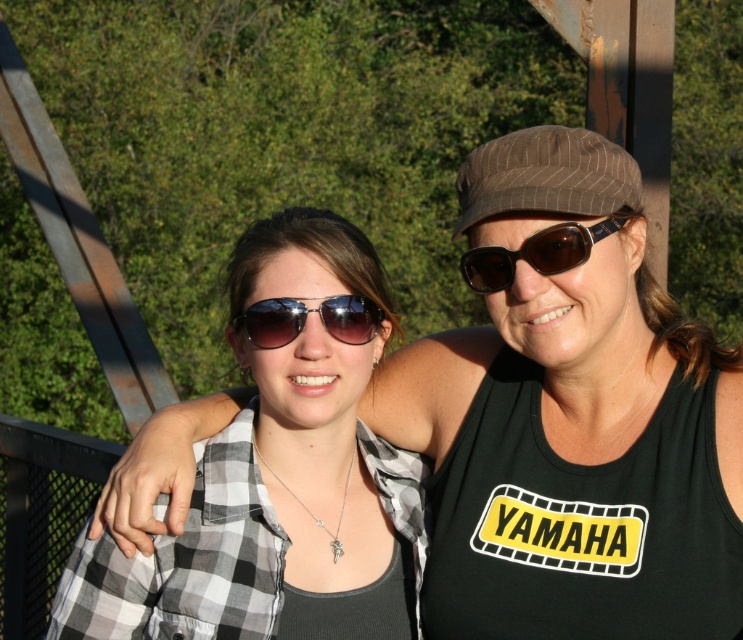
Can you confirm if black checkered shirt at center is positioned to the left of brown pinstripe baseball cap at upper right?

Correct, you'll find black checkered shirt at center to the left of brown pinstripe baseball cap at upper right.

Is point (444, 362) behind point (551, 193)?

Yes, it is behind point (551, 193).

This screenshot has height=640, width=743. Identify the location of black checkered shirt at center. (574, 458).

At what (x,y) coordinates should I click in order to perform the action: click on black checkered shirt at center. Please return your answer as a coordinate pair (x, y). The height and width of the screenshot is (640, 743). Looking at the image, I should click on (574, 458).

Between point (489, 429) and point (299, 321), which one is positioned in front?

Point (299, 321)

Which is behind, point (668, 563) or point (262, 340)?

Positioned behind is point (262, 340).

Identify the location of black fabric tank top at upper right. The width and height of the screenshot is (743, 640). (580, 524).

From the picture: Does brown reflective sunglasses at upper center appear over metallic reflective sunglasses at center?

Yes, brown reflective sunglasses at upper center is above metallic reflective sunglasses at center.

Does point (548, 227) come in front of point (334, 312)?

Yes.

What do you see at coordinates (536, 252) in the screenshot? Image resolution: width=743 pixels, height=640 pixels. I see `brown reflective sunglasses at upper center` at bounding box center [536, 252].

Locate an element on the screen. The image size is (743, 640). brown reflective sunglasses at upper center is located at coordinates pos(536,252).